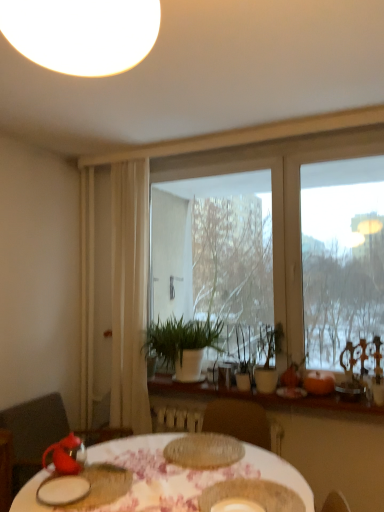
Identify the location of empty space that is in between white ceramic plate at lower left, which ranks as the second tableware in left-to-right order, and matte red teapot at lower left, positioned as the first tableware in left-to-right order. (85, 480).